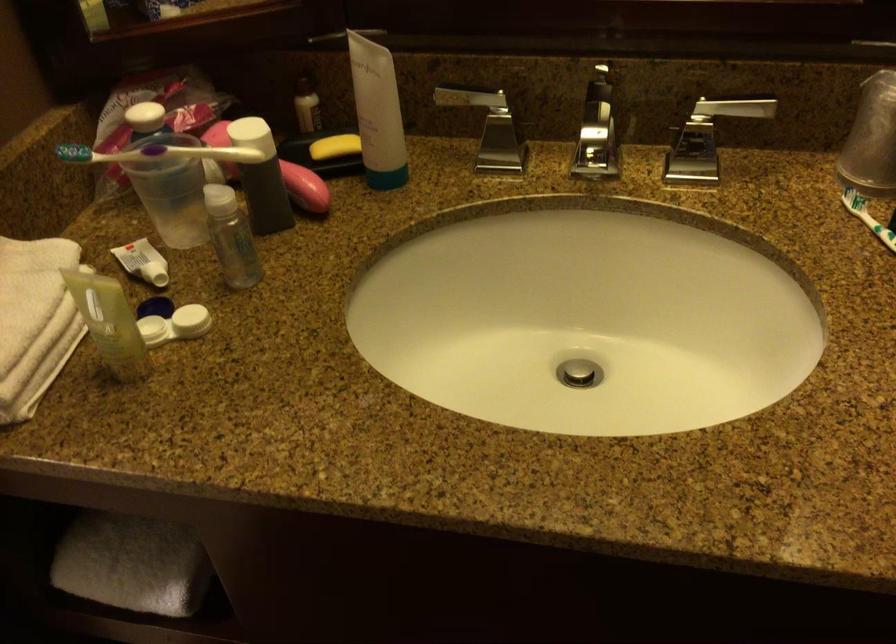
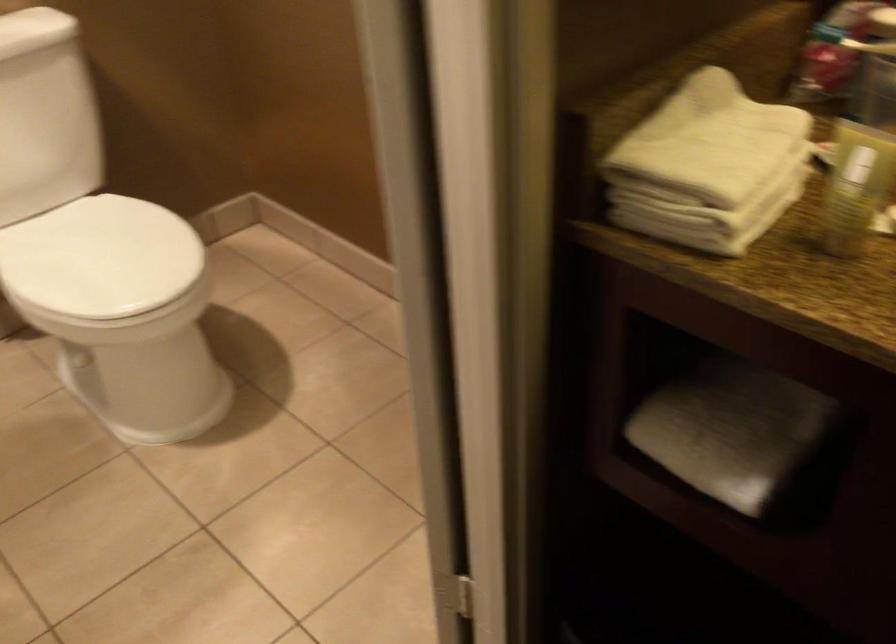
Find the pixel in the second image that matches (141,545) in the first image.

(730, 431)